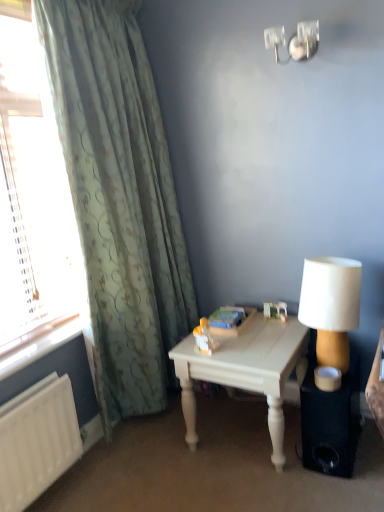
Locate an element on the screen. The width and height of the screenshot is (384, 512). vacant space situated above metallic wall sconce at upper right (from a real-world perspective) is located at coordinates (294, 28).